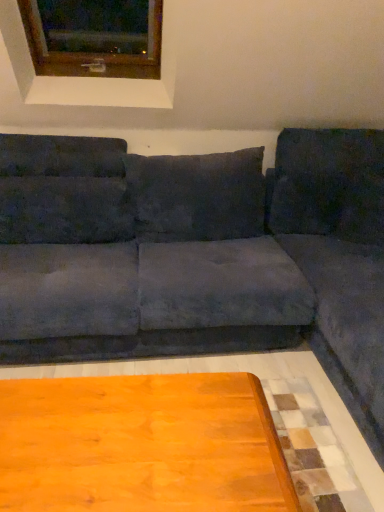
In order to face suede gray couch at center, should I rotate leftwards or rightwards?

It's best to rotate left around 8.779 degrees.

Measure the distance between suede gray couch at center and camera.

suede gray couch at center and camera are 1.60 meters apart from each other.

The image size is (384, 512). What do you see at coordinates (64, 210) in the screenshot?
I see `suede-like dark gray pillow at upper left, positioned as the 3th pillow in right-to-left order` at bounding box center [64, 210].

Measure the distance between point (149, 217) and camera.

The distance of point (149, 217) from camera is 2.50 meters.

What do you see at coordinates (141, 445) in the screenshot? I see `wooden table at lower center` at bounding box center [141, 445].

Measure the distance between velvet dark gray pillow at right, which is the 3th pillow in left-to-right order, and camera.

A distance of 2.38 meters exists between velvet dark gray pillow at right, which is the 3th pillow in left-to-right order, and camera.

Image resolution: width=384 pixels, height=512 pixels. I want to click on suede gray couch at center, so click(x=232, y=263).

From a real-world perspective, is velvet dark gray pillow at right, which is the 3th pillow in left-to-right order, under suede-like dark gray pillow at upper left, positioned as the 3th pillow in right-to-left order?

No, from a real-world perspective, velvet dark gray pillow at right, which is the 3th pillow in left-to-right order, is not beneath suede-like dark gray pillow at upper left, positioned as the 3th pillow in right-to-left order.

From the image's perspective, is velvet dark gray pillow at right, which appears as the first pillow when viewed from the right, beneath suede-like dark gray pillow at upper left, marked as the first pillow in a left-to-right arrangement?

No.

Can you tell me how much velvet dark gray pillow at right, which is the 3th pillow in left-to-right order, and suede-like dark gray pillow at upper left, marked as the first pillow in a left-to-right arrangement, differ in facing direction?

The facing directions of velvet dark gray pillow at right, which is the 3th pillow in left-to-right order, and suede-like dark gray pillow at upper left, marked as the first pillow in a left-to-right arrangement, are 3.45 degrees apart.

Considering their positions, is velvet dark gray pillow at right, which appears as the first pillow when viewed from the right, located in front of or behind suede-like dark gray pillow at upper left, marked as the first pillow in a left-to-right arrangement?

Visually, velvet dark gray pillow at right, which appears as the first pillow when viewed from the right, is located behind suede-like dark gray pillow at upper left, marked as the first pillow in a left-to-right arrangement.

Is velvet dark gray pillow at right, which appears as the first pillow when viewed from the right, at the back of wooden table at lower center?

wooden table at lower center does not have its back to velvet dark gray pillow at right, which appears as the first pillow when viewed from the right.

Is wooden table at lower center positioned far away from velvet dark gray pillow at right, which appears as the first pillow when viewed from the right?

wooden table at lower center is far away from velvet dark gray pillow at right, which appears as the first pillow when viewed from the right.

Is wooden table at lower center not within velvet dark gray pillow at right, which is the 3th pillow in left-to-right order?

Yes, wooden table at lower center is located beyond the bounds of velvet dark gray pillow at right, which is the 3th pillow in left-to-right order.

Is dark gray suede pillow at center, marked as the second pillow in a left-to-right arrangement, at the right side of wooden frame at upper left?

Correct, you'll find dark gray suede pillow at center, marked as the second pillow in a left-to-right arrangement, to the right of wooden frame at upper left.

In the image, is dark gray suede pillow at center, marked as the second pillow in a left-to-right arrangement, positioned in front of or behind wooden frame at upper left?

Visually, dark gray suede pillow at center, marked as the second pillow in a left-to-right arrangement, is located behind wooden frame at upper left.

How different are the orientations of dark gray suede pillow at center, the 2th pillow when ordered from right to left, and wooden frame at upper left in degrees?

dark gray suede pillow at center, the 2th pillow when ordered from right to left, and wooden frame at upper left are facing 4.95 degrees away from each other.

Between velvet dark gray pillow at right, which appears as the first pillow when viewed from the right, and wooden table at lower center, which one has less height?

Standing shorter between the two is wooden table at lower center.

Is velvet dark gray pillow at right, which is the 3th pillow in left-to-right order, turned away from wooden table at lower center?

No, wooden table at lower center is not at the back of velvet dark gray pillow at right, which is the 3th pillow in left-to-right order.

Image resolution: width=384 pixels, height=512 pixels. I want to click on table that appears below the velvet dark gray pillow at right, which is the 3th pillow in left-to-right order (from the image's perspective), so click(x=141, y=445).

Measure the distance between velvet dark gray pillow at right, which is the 3th pillow in left-to-right order, and suede gray couch at center.

A distance of 15.00 inches exists between velvet dark gray pillow at right, which is the 3th pillow in left-to-right order, and suede gray couch at center.

From the image's perspective, is velvet dark gray pillow at right, which appears as the first pillow when viewed from the right, above or below suede gray couch at center?

Clearly, from the image's perspective, velvet dark gray pillow at right, which appears as the first pillow when viewed from the right, is above suede gray couch at center.

Looking at the image, does velvet dark gray pillow at right, which is the 3th pillow in left-to-right order, seem bigger or smaller compared to suede gray couch at center?

Clearly, velvet dark gray pillow at right, which is the 3th pillow in left-to-right order, is smaller in size than suede gray couch at center.

Which is in front, velvet dark gray pillow at right, which appears as the first pillow when viewed from the right, or suede gray couch at center?

Positioned in front is suede gray couch at center.

Does dark gray suede pillow at center, the 2th pillow when ordered from right to left, have a lesser width compared to suede gray couch at center?

Yes, dark gray suede pillow at center, the 2th pillow when ordered from right to left, is thinner than suede gray couch at center.

Which object is more forward, dark gray suede pillow at center, the 2th pillow when ordered from right to left, or suede gray couch at center?

suede gray couch at center is closer to the camera.

Does dark gray suede pillow at center, the 2th pillow when ordered from right to left, have a larger size compared to suede gray couch at center?

No, dark gray suede pillow at center, the 2th pillow when ordered from right to left, is not bigger than suede gray couch at center.

Is dark gray suede pillow at center, marked as the second pillow in a left-to-right arrangement, aimed at suede gray couch at center?

Yes, dark gray suede pillow at center, marked as the second pillow in a left-to-right arrangement, is oriented towards suede gray couch at center.

Is the surface of suede-like dark gray pillow at upper left, marked as the first pillow in a left-to-right arrangement, in direct contact with velvet dark gray pillow at right, which is the 3th pillow in left-to-right order?

No, suede-like dark gray pillow at upper left, marked as the first pillow in a left-to-right arrangement, is not with velvet dark gray pillow at right, which is the 3th pillow in left-to-right order.

Can you tell me how much suede-like dark gray pillow at upper left, marked as the first pillow in a left-to-right arrangement, and velvet dark gray pillow at right, which appears as the first pillow when viewed from the right, differ in facing direction?

The angle between the facing direction of suede-like dark gray pillow at upper left, marked as the first pillow in a left-to-right arrangement, and the facing direction of velvet dark gray pillow at right, which appears as the first pillow when viewed from the right, is 3.45 degrees.

Is suede-like dark gray pillow at upper left, positioned as the 3th pillow in right-to-left order, turned away from velvet dark gray pillow at right, which appears as the first pillow when viewed from the right?

suede-like dark gray pillow at upper left, positioned as the 3th pillow in right-to-left order, does not have its back to velvet dark gray pillow at right, which appears as the first pillow when viewed from the right.

Considering the relative sizes of suede-like dark gray pillow at upper left, positioned as the 3th pillow in right-to-left order, and velvet dark gray pillow at right, which appears as the first pillow when viewed from the right, in the image provided, is suede-like dark gray pillow at upper left, positioned as the 3th pillow in right-to-left order, smaller than velvet dark gray pillow at right, which appears as the first pillow when viewed from the right,?

Yes, suede-like dark gray pillow at upper left, positioned as the 3th pillow in right-to-left order, is smaller than velvet dark gray pillow at right, which appears as the first pillow when viewed from the right.

Image resolution: width=384 pixels, height=512 pixels. I want to click on pillow below the velvet dark gray pillow at right, which is the 3th pillow in left-to-right order (from the image's perspective), so click(64, 210).

I want to click on table below the velvet dark gray pillow at right, which is the 3th pillow in left-to-right order (from a real-world perspective), so 141,445.

Estimate the real-world distances between objects in this image. Which object is closer to dark gray suede pillow at center, marked as the second pillow in a left-to-right arrangement, suede-like dark gray pillow at upper left, marked as the first pillow in a left-to-right arrangement, or velvet dark gray pillow at right, which is the 3th pillow in left-to-right order?

suede-like dark gray pillow at upper left, marked as the first pillow in a left-to-right arrangement.

Looking at the image, which one is located further to suede-like dark gray pillow at upper left, marked as the first pillow in a left-to-right arrangement, wooden frame at upper left or dark gray suede pillow at center, the 2th pillow when ordered from right to left?

The object further to suede-like dark gray pillow at upper left, marked as the first pillow in a left-to-right arrangement, is wooden frame at upper left.

Based on their spatial positions, is velvet dark gray pillow at right, which appears as the first pillow when viewed from the right, or dark gray suede pillow at center, marked as the second pillow in a left-to-right arrangement, further from wooden frame at upper left?

The object further to wooden frame at upper left is velvet dark gray pillow at right, which appears as the first pillow when viewed from the right.

Looking at the image, which one is located further to suede gray couch at center, velvet dark gray pillow at right, which appears as the first pillow when viewed from the right, or suede-like dark gray pillow at upper left, marked as the first pillow in a left-to-right arrangement?

suede-like dark gray pillow at upper left, marked as the first pillow in a left-to-right arrangement, is further to suede gray couch at center.

Looking at the image, which one is located closer to suede-like dark gray pillow at upper left, positioned as the 3th pillow in right-to-left order, dark gray suede pillow at center, the 2th pillow when ordered from right to left, or wooden table at lower center?

Based on the image, dark gray suede pillow at center, the 2th pillow when ordered from right to left, appears to be nearer to suede-like dark gray pillow at upper left, positioned as the 3th pillow in right-to-left order.

Estimate the real-world distances between objects in this image. Which object is closer to wooden table at lower center, dark gray suede pillow at center, the 2th pillow when ordered from right to left, or suede-like dark gray pillow at upper left, marked as the first pillow in a left-to-right arrangement?

Among the two, suede-like dark gray pillow at upper left, marked as the first pillow in a left-to-right arrangement, is located nearer to wooden table at lower center.

Looking at the image, which one is located closer to wooden table at lower center, suede gray couch at center or dark gray suede pillow at center, marked as the second pillow in a left-to-right arrangement?

suede gray couch at center is closer to wooden table at lower center.

When comparing their distances from velvet dark gray pillow at right, which is the 3th pillow in left-to-right order, does suede gray couch at center or wooden table at lower center seem closer?

suede gray couch at center.

I want to click on studio couch located between suede-like dark gray pillow at upper left, marked as the first pillow in a left-to-right arrangement, and velvet dark gray pillow at right, which is the 3th pillow in left-to-right order, in the left-right direction, so click(232, 263).

Locate an element on the screen. table between suede-like dark gray pillow at upper left, marked as the first pillow in a left-to-right arrangement, and velvet dark gray pillow at right, which appears as the first pillow when viewed from the right is located at coordinates (141, 445).

What are the coordinates of `studio couch between suede-like dark gray pillow at upper left, marked as the first pillow in a left-to-right arrangement, and dark gray suede pillow at center, marked as the second pillow in a left-to-right arrangement` in the screenshot? It's located at (232, 263).

This screenshot has width=384, height=512. In order to click on pillow between wooden table at lower center and suede-like dark gray pillow at upper left, marked as the first pillow in a left-to-right arrangement, along the z-axis in this screenshot , I will do `click(197, 196)`.